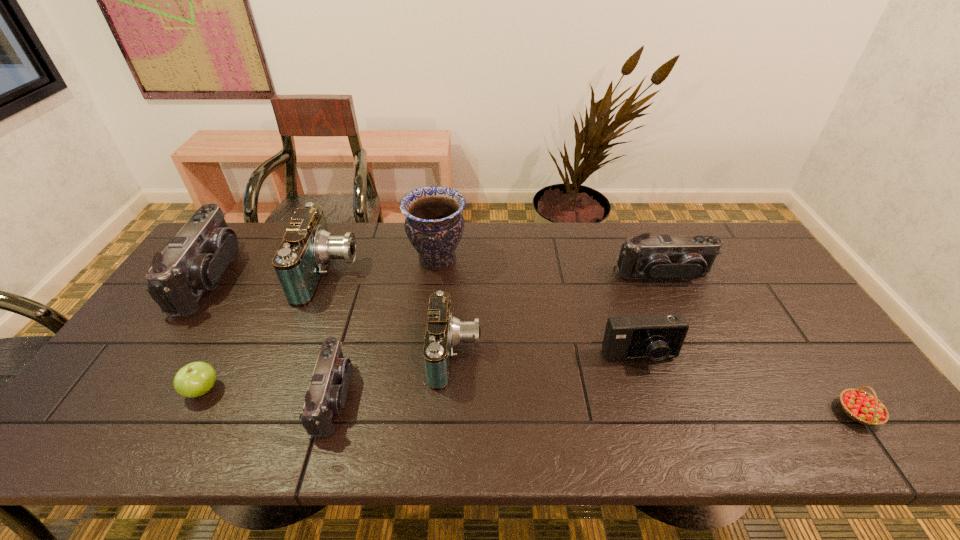
You are a GUI agent. You are given a task and a screenshot of the screen. Output one action in this format:
    pyautogui.click(x=<x>, y=<y>)
    Task: Click on the object at the far left corner
    The height and width of the screenshot is (540, 960).
    Given the screenshot: What is the action you would take?
    pyautogui.click(x=194, y=260)

You are a GUI agent. You are given a task and a screenshot of the screen. Output one action in this format:
    pyautogui.click(x=<x>, y=<y>)
    Task: Click on the object that is at the near right corner
    This screenshot has height=540, width=960.
    Given the screenshot: What is the action you would take?
    pyautogui.click(x=862, y=407)

Image resolution: width=960 pixels, height=540 pixels. In order to click on vacant space at the far edge of the desktop in this screenshot , I will do `click(338, 233)`.

Identify the location of blank area at the near edge. The height and width of the screenshot is (540, 960). (704, 419).

You are a GUI agent. You are given a task and a screenshot of the screen. Output one action in this format:
    pyautogui.click(x=<x>, y=<y>)
    Task: Click on the vacant space at the left edge of the desktop
    
    Given the screenshot: What is the action you would take?
    pyautogui.click(x=159, y=335)

Image resolution: width=960 pixels, height=540 pixels. In the image, there is a desktop. What are the coordinates of `vacant space at the right edge` in the screenshot? It's located at (747, 285).

Find the location of a particular element. Image resolution: width=960 pixels, height=540 pixels. vacant position at the far left corner of the desktop is located at coordinates (260, 228).

At what (x,y) coordinates should I click in order to perform the action: click on vacant space at the far right corner. Please return your answer as a coordinate pair (x, y). The height and width of the screenshot is (540, 960). Looking at the image, I should click on (749, 247).

This screenshot has height=540, width=960. Find the location of `free space between the smallest black camcorder and the camera`. free space between the smallest black camcorder and the camera is located at coordinates (487, 377).

This screenshot has width=960, height=540. I want to click on vacant space that's between the second biggest black camcorder and the pottery, so click(x=550, y=267).